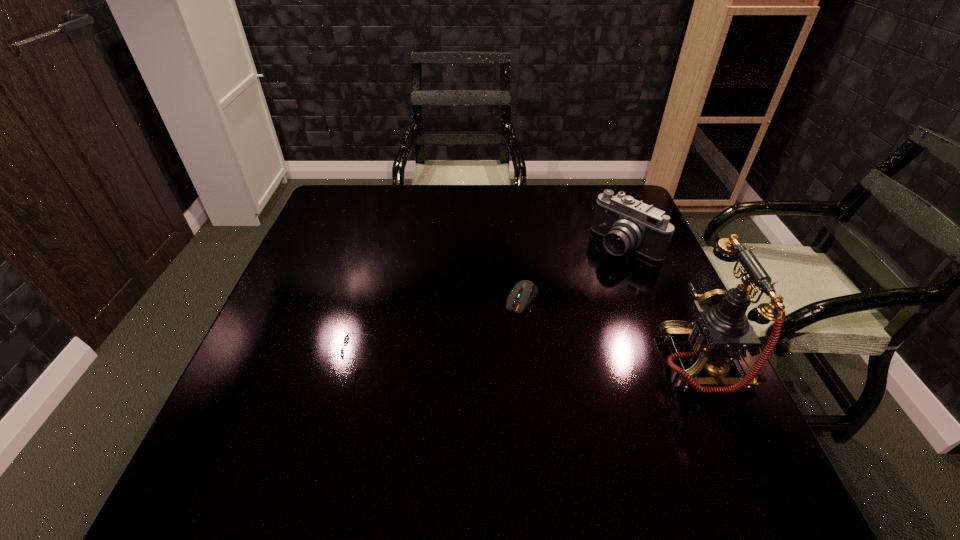
Locate an element on the screen. This screenshot has width=960, height=540. free region located 0.310m on the front-facing side of the second tallest object is located at coordinates (539, 322).

Find the location of a particular element. The height and width of the screenshot is (540, 960). free space located on the front-facing side of the second tallest object is located at coordinates (591, 276).

The width and height of the screenshot is (960, 540). I want to click on vacant space located on the front-facing side of the second tallest object, so click(543, 318).

Where is `vacant space located 0.150m on the button of the shortest object`? vacant space located 0.150m on the button of the shortest object is located at coordinates (488, 361).

The width and height of the screenshot is (960, 540). Find the location of `blank space located on the button of the shortest object`. blank space located on the button of the shortest object is located at coordinates (488, 361).

I want to click on vacant space located 0.340m on the button of the shortest object, so click(444, 435).

The width and height of the screenshot is (960, 540). I want to click on object that is at the far edge, so click(x=627, y=224).

This screenshot has height=540, width=960. I want to click on object present at the near edge, so click(x=720, y=331).

Identify the location of telephone that is at the right edge. This screenshot has height=540, width=960. (720, 331).

Where is `camera at the right edge`? The image size is (960, 540). camera at the right edge is located at coordinates (627, 224).